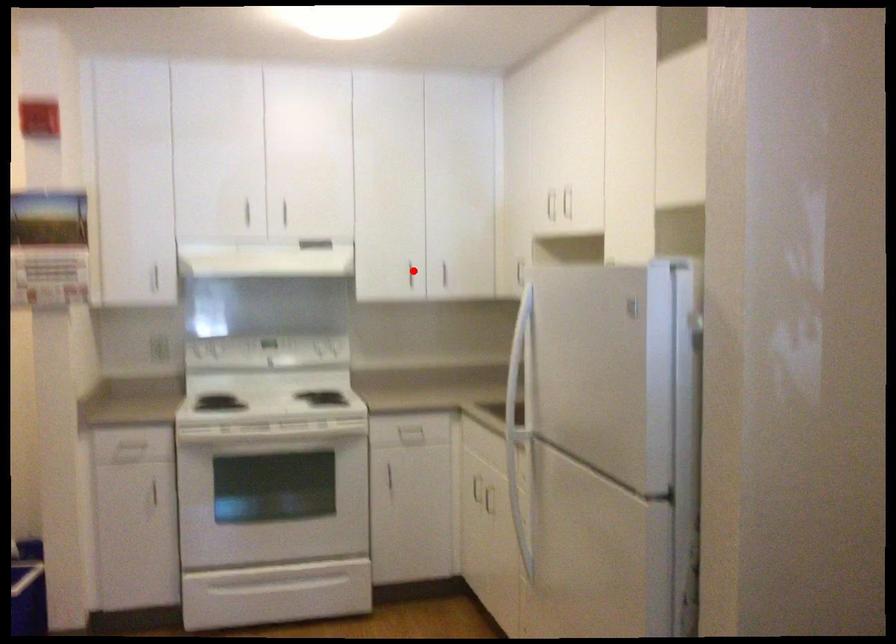
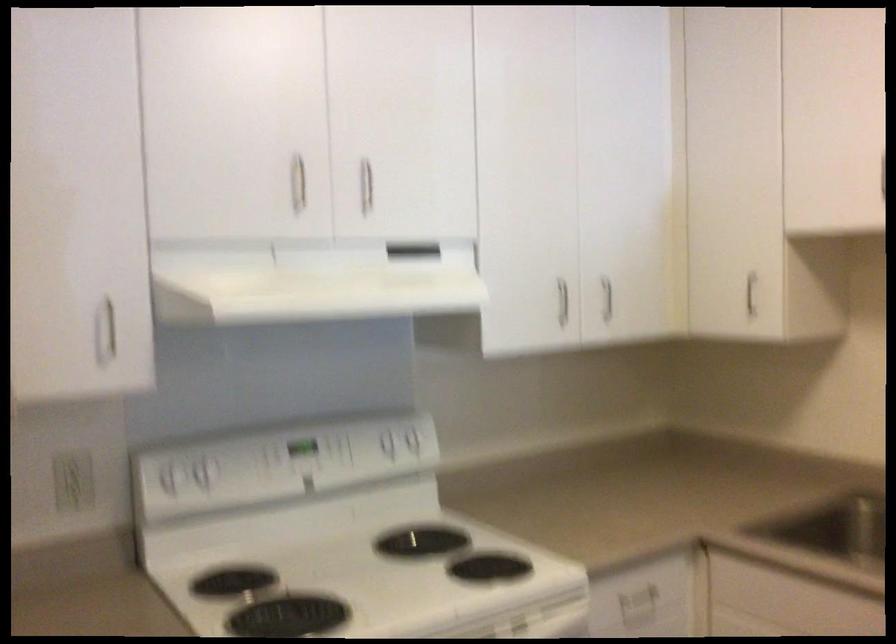
The point at the highlighted location is marked in the first image. Where is the corresponding point in the second image?

(562, 301)